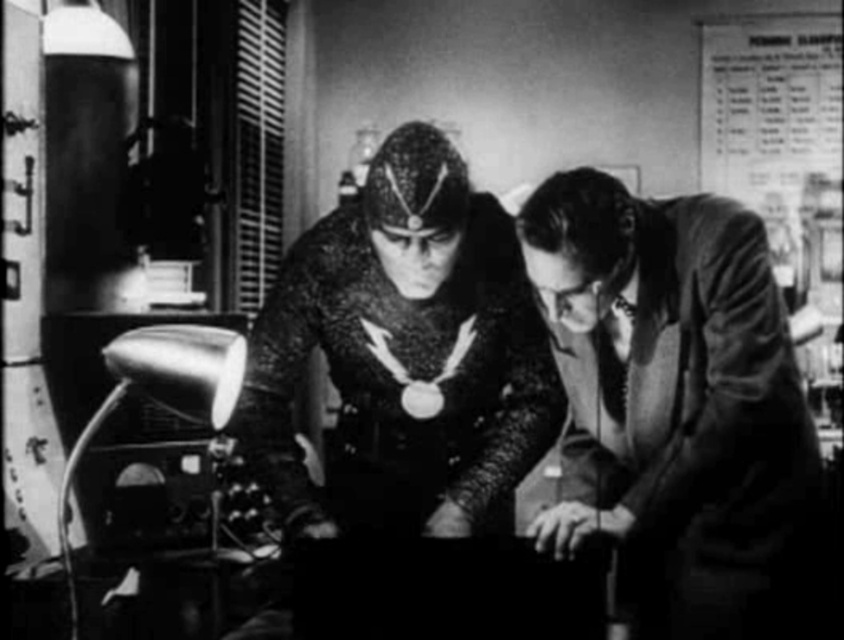
Does metallic chainmail suit at center have a lesser height compared to metallic mesh suit at center?

No, metallic chainmail suit at center is not shorter than metallic mesh suit at center.

Does point (636, 218) lie behind point (533, 316)?

No, it is in front of (533, 316).

Locate an element on the screen. metallic chainmail suit at center is located at coordinates (675, 404).